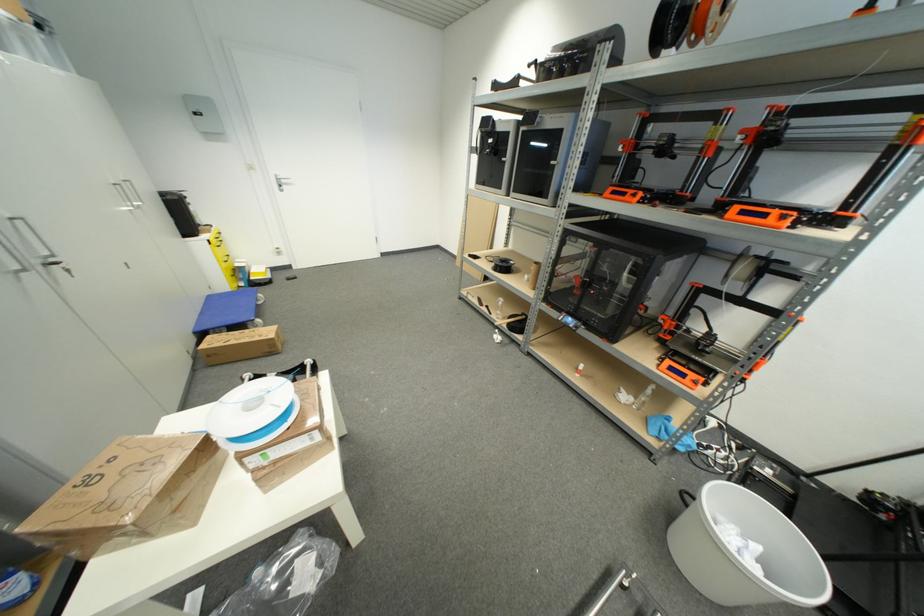
Which object does [239,345] point to?

It corresponds to the cardboard box in the image.